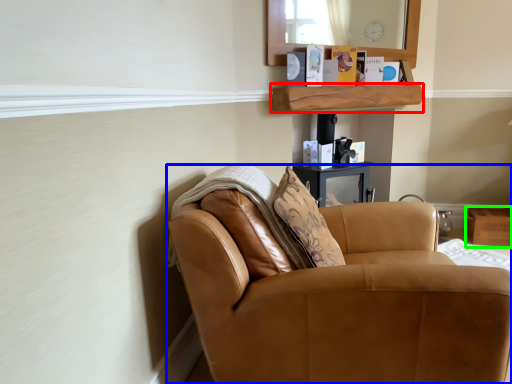
Question: Considering the real-world distances, which object is closest to shelf (highlighted by a red box)? chair (highlighted by a blue box) or box (highlighted by a green box).

Choices:
 (A) chair
 (B) box

Answer: (B)